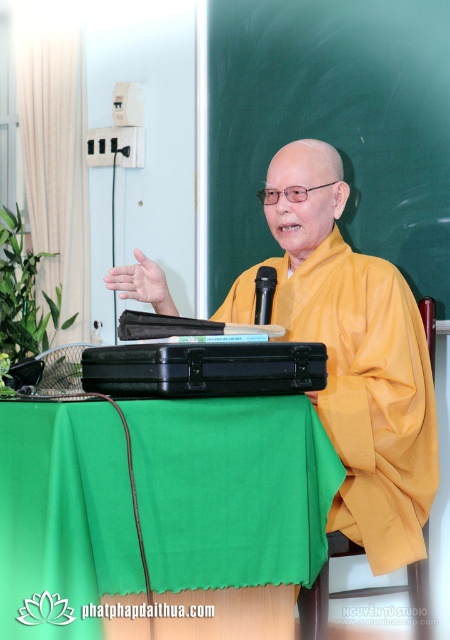
Question: Can you confirm if green fabric table at center is positioned to the left of black plastic microphone at center?

Choices:
 (A) yes
 (B) no

Answer: (A)

Question: Can you confirm if green fabric table at center is positioned below black plastic microphone at center?

Choices:
 (A) yes
 (B) no

Answer: (A)

Question: Which object is farther from the camera taking this photo?

Choices:
 (A) yellow matte robe at center
 (B) black plastic microphone at center
 (C) green fabric table at center

Answer: (B)

Question: Among these objects, which one is farthest from the camera?

Choices:
 (A) green fabric table at center
 (B) black plastic microphone at center

Answer: (B)

Question: Which object is the farthest from the green fabric table at center?

Choices:
 (A) yellow matte robe at center
 (B) black plastic microphone at center

Answer: (B)

Question: In this image, where is yellow matte robe at center located relative to black plastic microphone at center?

Choices:
 (A) left
 (B) right

Answer: (B)